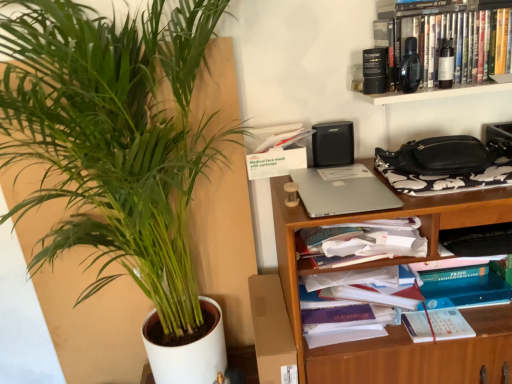
Question: Can you confirm if green leafy plant at left is shorter than black plastic shelf at upper right, placed as the second shelf when sorted from bottom to top?

Choices:
 (A) yes
 (B) no

Answer: (B)

Question: Does green leafy plant at left have a lesser width compared to black plastic shelf at upper right, placed as the second shelf when sorted from bottom to top?

Choices:
 (A) no
 (B) yes

Answer: (B)

Question: Is green leafy plant at left not within black plastic shelf at upper right, placed as the second shelf when sorted from bottom to top?

Choices:
 (A) no
 (B) yes

Answer: (B)

Question: Considering the relative positions of green leafy plant at left and black plastic shelf at upper right, placed as the second shelf when sorted from bottom to top, in the image provided, is green leafy plant at left to the right of black plastic shelf at upper right, placed as the second shelf when sorted from bottom to top, from the viewer's perspective?

Choices:
 (A) yes
 (B) no

Answer: (B)

Question: Considering the relative sizes of green leafy plant at left and black plastic shelf at upper right, acting as the 1th shelf starting from the top, in the image provided, is green leafy plant at left wider than black plastic shelf at upper right, acting as the 1th shelf starting from the top,?

Choices:
 (A) no
 (B) yes

Answer: (A)

Question: Would you say wooden bookshelf at center-right, the 1th shelf in the bottom-to-top sequence, is to the left or to the right of green leafy plant at left in the picture?

Choices:
 (A) right
 (B) left

Answer: (A)

Question: From their relative heights in the image, would you say wooden bookshelf at center-right, the 1th shelf in the bottom-to-top sequence, is taller or shorter than green leafy plant at left?

Choices:
 (A) short
 (B) tall

Answer: (A)

Question: Is point (478, 198) positioned closer to the camera than point (184, 208)?

Choices:
 (A) closer
 (B) farther

Answer: (A)

Question: From the image's perspective, is wooden bookshelf at center-right, the 1th shelf in the bottom-to-top sequence, located above or below green leafy plant at left?

Choices:
 (A) below
 (B) above

Answer: (A)

Question: Considering the positions of black plastic shelf at upper right, acting as the 1th shelf starting from the top, and silver metallic laptop at center-right in the image, is black plastic shelf at upper right, acting as the 1th shelf starting from the top, taller or shorter than silver metallic laptop at center-right?

Choices:
 (A) short
 (B) tall

Answer: (B)

Question: Based on their positions, is black plastic shelf at upper right, acting as the 1th shelf starting from the top, located to the left or right of silver metallic laptop at center-right?

Choices:
 (A) left
 (B) right

Answer: (B)

Question: Is point (377, 39) positioned closer to the camera than point (362, 175)?

Choices:
 (A) closer
 (B) farther

Answer: (A)

Question: From the image's perspective, is black plastic shelf at upper right, placed as the second shelf when sorted from bottom to top, located above or below silver metallic laptop at center-right?

Choices:
 (A) above
 (B) below

Answer: (A)

Question: Is point (404, 205) closer or farther from the camera than point (309, 185)?

Choices:
 (A) farther
 (B) closer

Answer: (B)

Question: Looking at the image, does wooden bookshelf at center-right, marked as the second shelf in a top-to-bottom arrangement, seem bigger or smaller compared to silver metallic laptop at center-right?

Choices:
 (A) small
 (B) big

Answer: (B)